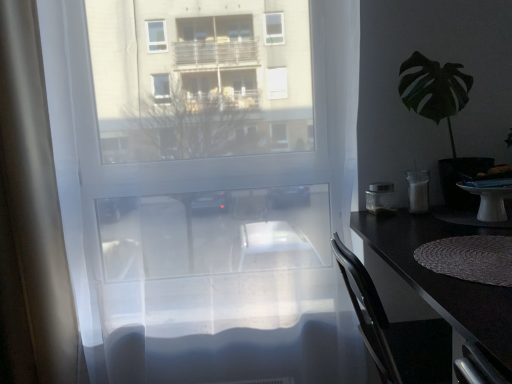
The width and height of the screenshot is (512, 384). What do you see at coordinates (380, 198) in the screenshot?
I see `metallic silver container at right, marked as the 1th appliance in a left-to-right arrangement` at bounding box center [380, 198].

Image resolution: width=512 pixels, height=384 pixels. Describe the element at coordinates (441, 115) in the screenshot. I see `green leafy plant at right` at that location.

This screenshot has width=512, height=384. What are the coordinates of `white opaque glass at right, which is counted as the second appliance, starting from the left` in the screenshot? It's located at (418, 191).

Measure the distance between white opaque glass at right, which is counted as the second appliance, starting from the left, and black glossy desk at right.

white opaque glass at right, which is counted as the second appliance, starting from the left, is 4.66 inches from black glossy desk at right.

Do you think white opaque glass at right, placed as the first appliance when sorted from right to left, is within black glossy desk at right, or outside of it?

white opaque glass at right, placed as the first appliance when sorted from right to left, cannot be found inside black glossy desk at right.

In the scene shown: Is white opaque glass at right, placed as the first appliance when sorted from right to left, closer to the viewer compared to black glossy desk at right?

No, white opaque glass at right, placed as the first appliance when sorted from right to left, is further to the viewer.

Is white opaque glass at right, which is counted as the second appliance, starting from the left, positioned far away from black glossy desk at right?

Actually, white opaque glass at right, which is counted as the second appliance, starting from the left, and black glossy desk at right are a little close together.

Can you confirm if metallic silver container at right, which is counted as the 2th appliance, starting from the right, is positioned to the right of white opaque glass at right, which is counted as the second appliance, starting from the left?

Incorrect, metallic silver container at right, which is counted as the 2th appliance, starting from the right, is not on the right side of white opaque glass at right, which is counted as the second appliance, starting from the left.

Which is behind, point (385, 211) or point (426, 184)?

Positioned behind is point (385, 211).

What's the angular difference between metallic silver container at right, which is counted as the 2th appliance, starting from the right, and white opaque glass at right, which is counted as the second appliance, starting from the left,'s facing directions?

0.000208 degrees.

Is black glossy desk at right turned away from metallic silver container at right, marked as the 1th appliance in a left-to-right arrangement?

No, metallic silver container at right, marked as the 1th appliance in a left-to-right arrangement, is not at the back of black glossy desk at right.

Who is taller, black glossy desk at right or metallic silver container at right, which is counted as the 2th appliance, starting from the right?

Standing taller between the two is black glossy desk at right.

Where is `desk located in front of the metallic silver container at right, marked as the 1th appliance in a left-to-right arrangement`? This screenshot has width=512, height=384. desk located in front of the metallic silver container at right, marked as the 1th appliance in a left-to-right arrangement is located at coordinates (442, 277).

Which is closer to the camera, (493, 315) or (383, 186)?

Point (493, 315) appears to be closer to the viewer than point (383, 186).

Is metallic silver container at right, marked as the 1th appliance in a left-to-right arrangement, to the left of green leafy plant at right from the viewer's perspective?

Yes.

Which is farther, (383, 188) or (421, 83)?

The point (383, 188) is behind.

Who is smaller, metallic silver container at right, which is counted as the 2th appliance, starting from the right, or green leafy plant at right?

Smaller between the two is metallic silver container at right, which is counted as the 2th appliance, starting from the right.

From a real-world perspective, is metallic silver container at right, marked as the 1th appliance in a left-to-right arrangement, physically located above or below green leafy plant at right?

metallic silver container at right, marked as the 1th appliance in a left-to-right arrangement, is situated lower than green leafy plant at right in the real world.

From a real-world perspective, is green leafy plant at right located higher than metallic silver container at right, marked as the 1th appliance in a left-to-right arrangement?

Yes.

Image resolution: width=512 pixels, height=384 pixels. There is a green leafy plant at right. Find the location of `the 2nd appliance below it (from a real-world perspective)`. the 2nd appliance below it (from a real-world perspective) is located at coordinates (380, 198).

From the picture: Which is closer to the camera, (x=440, y=117) or (x=379, y=210)?

Point (x=440, y=117) is positioned closer to the camera compared to point (x=379, y=210).

Can you confirm if green leafy plant at right is wider than metallic silver container at right, which is counted as the 2th appliance, starting from the right?

Correct, the width of green leafy plant at right exceeds that of metallic silver container at right, which is counted as the 2th appliance, starting from the right.

Considering the positions of points (388, 184) and (456, 279), is point (388, 184) farther from camera compared to point (456, 279)?

Yes, point (388, 184) is farther from viewer.

Can you confirm if metallic silver container at right, which is counted as the 2th appliance, starting from the right, is taller than black glossy desk at right?

Incorrect, the height of metallic silver container at right, which is counted as the 2th appliance, starting from the right, is not larger of that of black glossy desk at right.

Is metallic silver container at right, which is counted as the 2th appliance, starting from the right, touching black glossy desk at right?

No, metallic silver container at right, which is counted as the 2th appliance, starting from the right, is not making contact with black glossy desk at right.

Is metallic silver container at right, marked as the 1th appliance in a left-to-right arrangement, to the right of black glossy desk at right from the viewer's perspective?

No.

Is green leafy plant at right not inside black glossy desk at right?

Yes.

From a real-world perspective, is green leafy plant at right over black glossy desk at right?

Correct, in the physical world, green leafy plant at right is higher than black glossy desk at right.

Which object is wider, green leafy plant at right or black glossy desk at right?

black glossy desk at right is wider.

Image resolution: width=512 pixels, height=384 pixels. Find the location of `houseplant on the right of black glossy desk at right`. houseplant on the right of black glossy desk at right is located at coordinates (441, 115).

I want to click on the 1st appliance behind the black glossy desk at right, so click(418, 191).

Where is `appliance above the metallic silver container at right, which is counted as the 2th appliance, starting from the right (from the image's perspective)`? The image size is (512, 384). appliance above the metallic silver container at right, which is counted as the 2th appliance, starting from the right (from the image's perspective) is located at coordinates (x=418, y=191).

From the image, which object appears to be farther from metallic silver container at right, which is counted as the 2th appliance, starting from the right, green leafy plant at right or white opaque glass at right, which is counted as the second appliance, starting from the left?

green leafy plant at right is further to metallic silver container at right, which is counted as the 2th appliance, starting from the right.

Estimate the real-world distances between objects in this image. Which object is further from green leafy plant at right, white opaque glass at right, placed as the first appliance when sorted from right to left, or metallic silver container at right, which is counted as the 2th appliance, starting from the right?

Based on the image, metallic silver container at right, which is counted as the 2th appliance, starting from the right, appears to be further to green leafy plant at right.

Looking at the image, which one is located closer to black glossy desk at right, green leafy plant at right or metallic silver container at right, which is counted as the 2th appliance, starting from the right?

Among the two, metallic silver container at right, which is counted as the 2th appliance, starting from the right, is located nearer to black glossy desk at right.

Which object lies nearer to the anchor point white opaque glass at right, which is counted as the second appliance, starting from the left, metallic silver container at right, which is counted as the 2th appliance, starting from the right, or green leafy plant at right?

metallic silver container at right, which is counted as the 2th appliance, starting from the right, is positioned closer to the anchor white opaque glass at right, which is counted as the second appliance, starting from the left.

From the image, which object appears to be farther from green leafy plant at right, black glossy desk at right or white opaque glass at right, which is counted as the second appliance, starting from the left?

black glossy desk at right.

Estimate the real-world distances between objects in this image. Which object is closer to black glossy desk at right, green leafy plant at right or white opaque glass at right, placed as the first appliance when sorted from right to left?

Based on the image, white opaque glass at right, placed as the first appliance when sorted from right to left, appears to be nearer to black glossy desk at right.

From the image, which object appears to be nearer to green leafy plant at right, metallic silver container at right, which is counted as the 2th appliance, starting from the right, or white opaque glass at right, which is counted as the second appliance, starting from the left?

white opaque glass at right, which is counted as the second appliance, starting from the left.

Considering their positions, is white opaque glass at right, which is counted as the second appliance, starting from the left, positioned closer to green leafy plant at right than black glossy desk at right?

Based on the image, white opaque glass at right, which is counted as the second appliance, starting from the left, appears to be nearer to green leafy plant at right.

The width and height of the screenshot is (512, 384). I want to click on appliance positioned between black glossy desk at right and metallic silver container at right, which is counted as the 2th appliance, starting from the right, from near to far, so point(418,191).

Where is `appliance between green leafy plant at right and metallic silver container at right, marked as the 1th appliance in a left-to-right arrangement, vertically`? This screenshot has width=512, height=384. appliance between green leafy plant at right and metallic silver container at right, marked as the 1th appliance in a left-to-right arrangement, vertically is located at coordinates (418, 191).

Find the location of a particular element. houseplant located between black glossy desk at right and white opaque glass at right, which is counted as the second appliance, starting from the left, in the depth direction is located at coordinates (441, 115).

Image resolution: width=512 pixels, height=384 pixels. I want to click on houseplant between black glossy desk at right and metallic silver container at right, which is counted as the 2th appliance, starting from the right, along the z-axis, so click(441, 115).